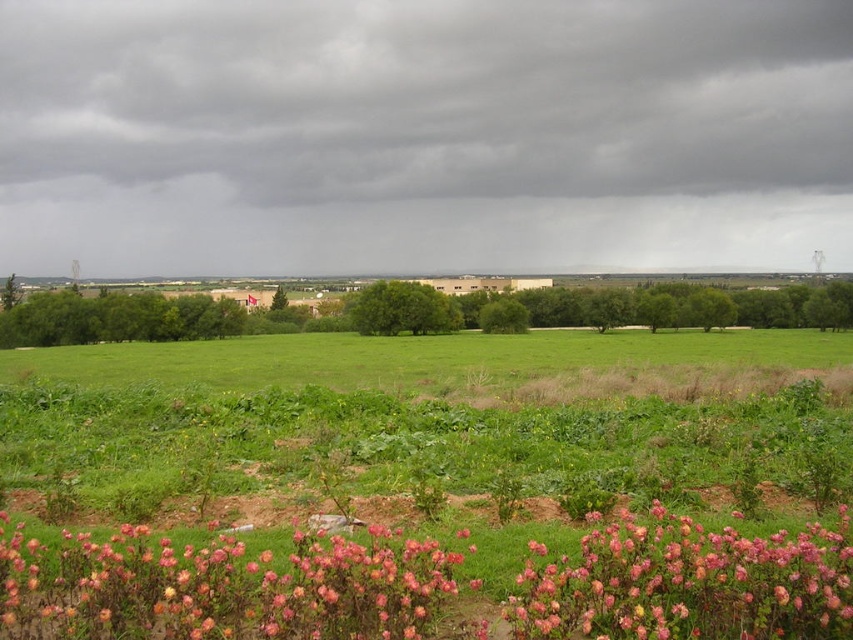
Does pink fluffy flowers at lower center lie in front of green grassy field at center?

Yes, it is.

Does pink fluffy flowers at lower center have a greater width compared to green grassy field at center?

In fact, pink fluffy flowers at lower center might be narrower than green grassy field at center.

In order to click on pink fluffy flowers at lower center in this screenshot , I will do `click(688, 582)`.

Identify the location of pink fluffy flowers at lower center. The width and height of the screenshot is (853, 640). (688, 582).

Does point (244, 596) lie behind point (154, 349)?

No, (244, 596) is in front of (154, 349).

Between pink matte flowers at lower center and green grassy field at center, which one has less height?

pink matte flowers at lower center is shorter.

The image size is (853, 640). I want to click on pink matte flowers at lower center, so click(221, 588).

Can you confirm if pink matte flowers at lower center is bigger than pink fluffy flowers at lower center?

Actually, pink matte flowers at lower center might be smaller than pink fluffy flowers at lower center.

Is point (215, 579) in front of point (616, 532)?

Yes, it is.

Locate an element on the screen. This screenshot has height=640, width=853. pink matte flowers at lower center is located at coordinates (221, 588).